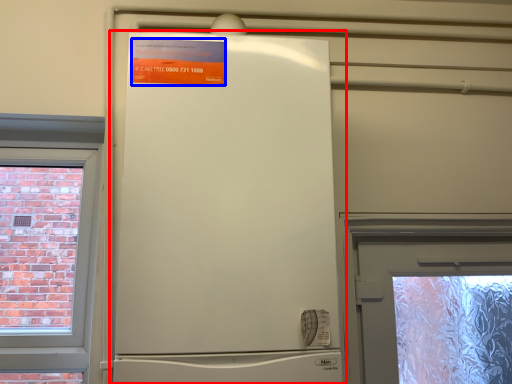
Question: Which point is closer to the camera, refrigerator (highlighted by a red box) or poster (highlighted by a blue box)?

Choices:
 (A) refrigerator
 (B) poster

Answer: (A)